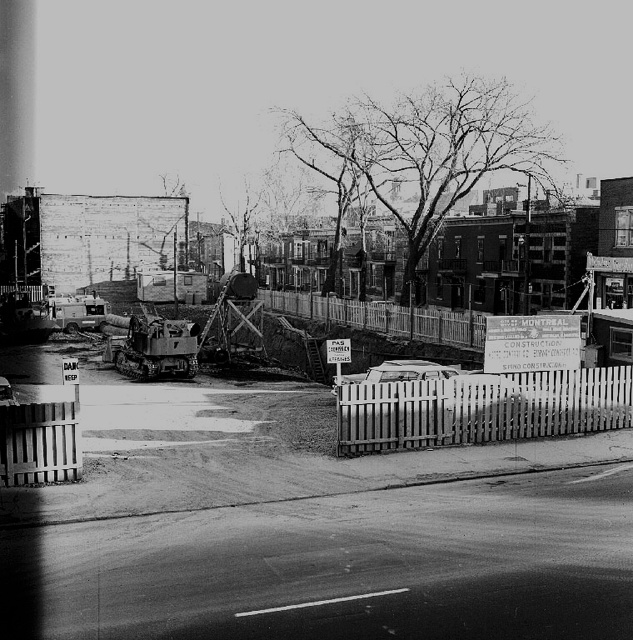
Is wooden picket fence at lower right to the right of white picket fence at center from the viewer's perspective?

Yes, wooden picket fence at lower right is to the right of white picket fence at center.

Which of these two, wooden picket fence at lower right or white picket fence at center, stands taller?

white picket fence at center is taller.

Does point (527, 378) come farther from viewer compared to point (311, 310)?

That is False.

Where is `wooden picket fence at lower right`? The width and height of the screenshot is (633, 640). wooden picket fence at lower right is located at coordinates (480, 408).